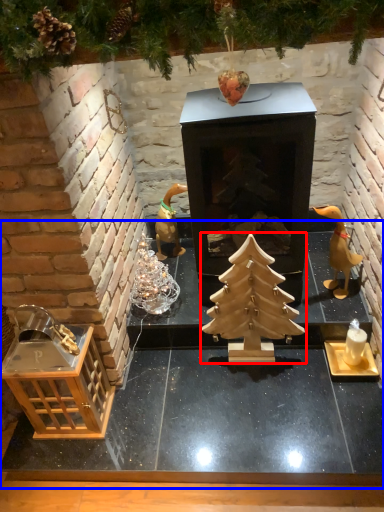
Question: Which point is further to the camera, christmas tree (highlighted by a red box) or table (highlighted by a blue box)?

Choices:
 (A) christmas tree
 (B) table

Answer: (A)